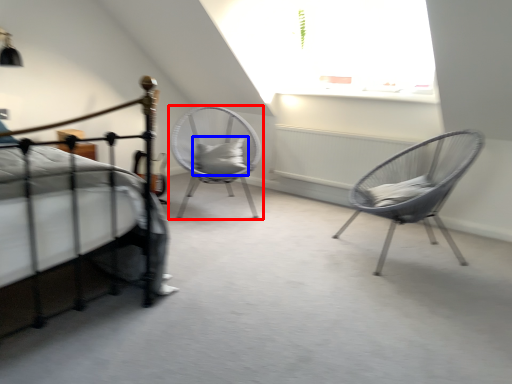
Question: Which object is further to the camera taking this photo, chair (highlighted by a red box) or pillow (highlighted by a blue box)?

Choices:
 (A) chair
 (B) pillow

Answer: (B)